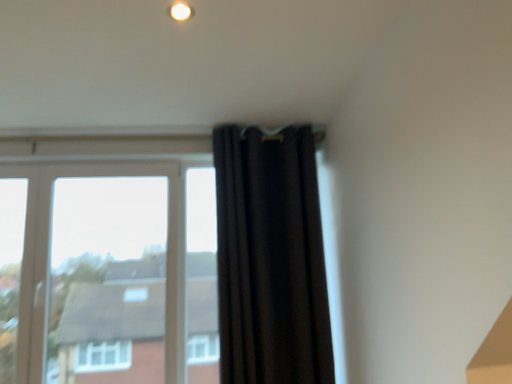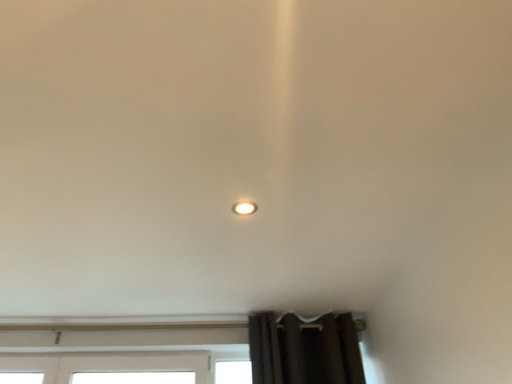
Question: How did the camera likely rotate when shooting the video?

Choices:
 (A) rotated upward
 (B) rotated downward

Answer: (A)